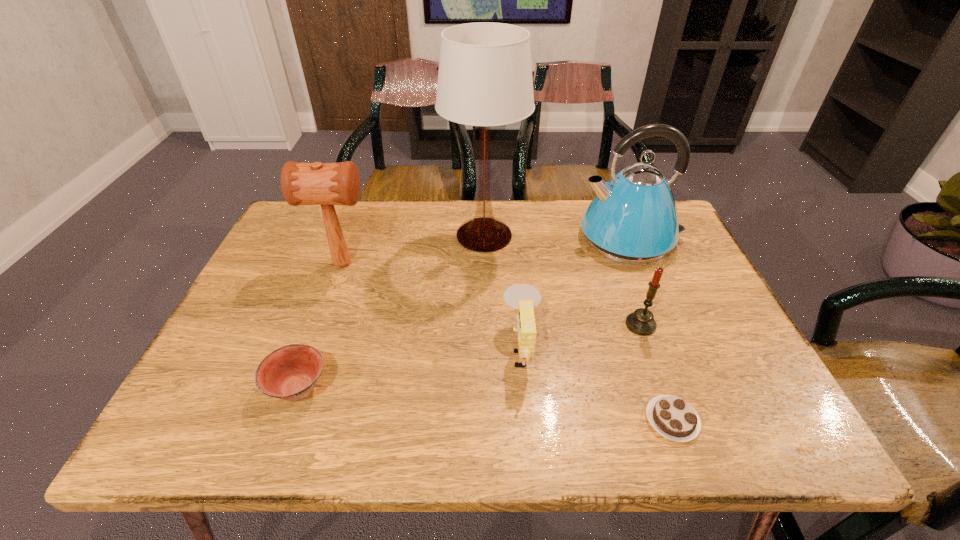
Find the location of a particular element. This screenshot has height=540, width=960. empty location between the third shortest object and the kettle is located at coordinates (576, 293).

The height and width of the screenshot is (540, 960). Find the location of `vacant area that lies between the fifth tallest object and the kettle`. vacant area that lies between the fifth tallest object and the kettle is located at coordinates (576, 293).

The height and width of the screenshot is (540, 960). What are the coordinates of `vacant space in between the chocolate cake and the third shortest object` in the screenshot? It's located at (597, 384).

What are the coordinates of `free spot between the fifth tallest object and the table lamp` in the screenshot? It's located at (503, 292).

Point out which object is positioned as the sixth nearest to the table lamp. Please provide its 2D coordinates. Your answer should be formatted as a tuple, i.e. [(x, y)], where the tuple contains the x and y coordinates of a point satisfying the conditions above.

[(672, 417)]

The image size is (960, 540). In order to click on object that is the fourth nearest to the mallet in this screenshot , I will do `click(633, 219)`.

Where is `free space that satisfies the following two spatial constraints: 1. on the strike surface of the mallet; 2. on the back side of the chocolate cake`? free space that satisfies the following two spatial constraints: 1. on the strike surface of the mallet; 2. on the back side of the chocolate cake is located at coordinates (287, 420).

At what (x,y) coordinates should I click in order to perform the action: click on free spot that satisfies the following two spatial constraints: 1. at the spout of the kettle; 2. on the front side of the chocolate cake. Please return your answer as a coordinate pair (x, y). The width and height of the screenshot is (960, 540). Looking at the image, I should click on (705, 420).

The image size is (960, 540). I want to click on vacant area in the image that satisfies the following two spatial constraints: 1. on the front-facing side of the fifth tallest object; 2. on the front side of the bowl, so click(525, 389).

Where is `free space that satisfies the following two spatial constraints: 1. on the strike surface of the mallet; 2. on the left side of the candle`? The height and width of the screenshot is (540, 960). free space that satisfies the following two spatial constraints: 1. on the strike surface of the mallet; 2. on the left side of the candle is located at coordinates (322, 325).